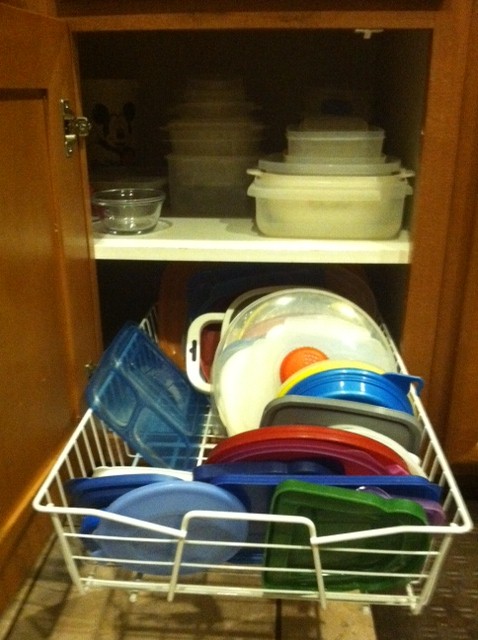
I want to click on rack, so click(93, 532).